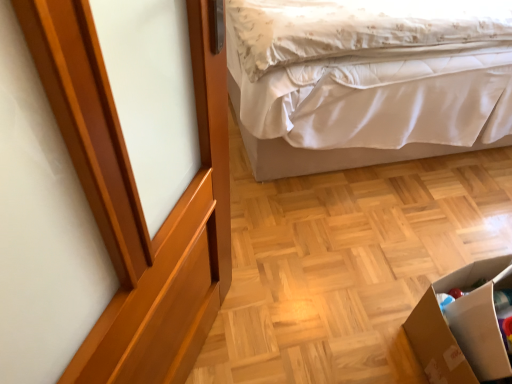
Question: From a real-world perspective, relative to glossy wood screen door at upper left, is white satin bed at upper right vertically above or below?

Choices:
 (A) below
 (B) above

Answer: (A)

Question: From the image's perspective, relative to glossy wood screen door at upper left, is white satin bed at upper right above or below?

Choices:
 (A) above
 (B) below

Answer: (A)

Question: Which object is positioned farthest from the glossy wood screen door at upper left?

Choices:
 (A) white satin bed at upper right
 (B) cardboard box at lower right

Answer: (A)

Question: Which object is positioned closest to the glossy wood screen door at upper left?

Choices:
 (A) cardboard box at lower right
 (B) white satin bed at upper right

Answer: (A)